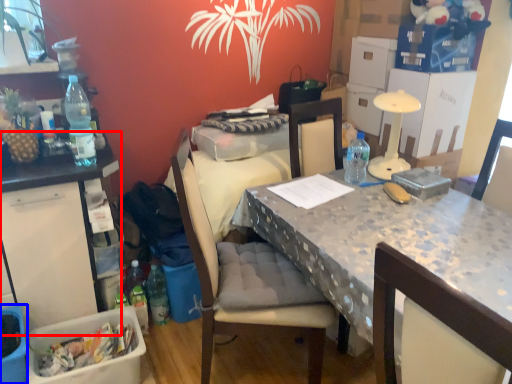
Question: Which object appears closest to the camera in this image, table (highlighted by a red box) or picnic basket (highlighted by a blue box)?

Choices:
 (A) table
 (B) picnic basket

Answer: (B)